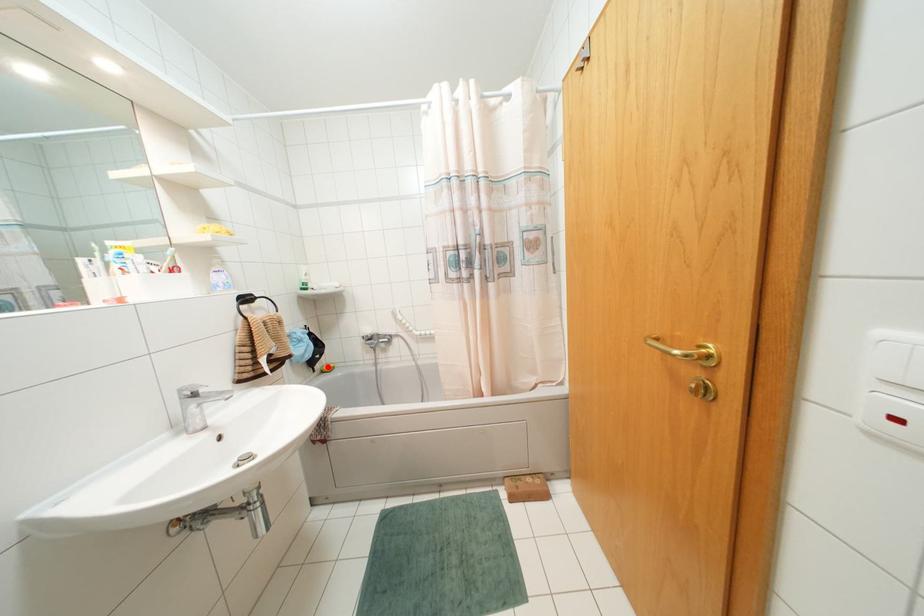
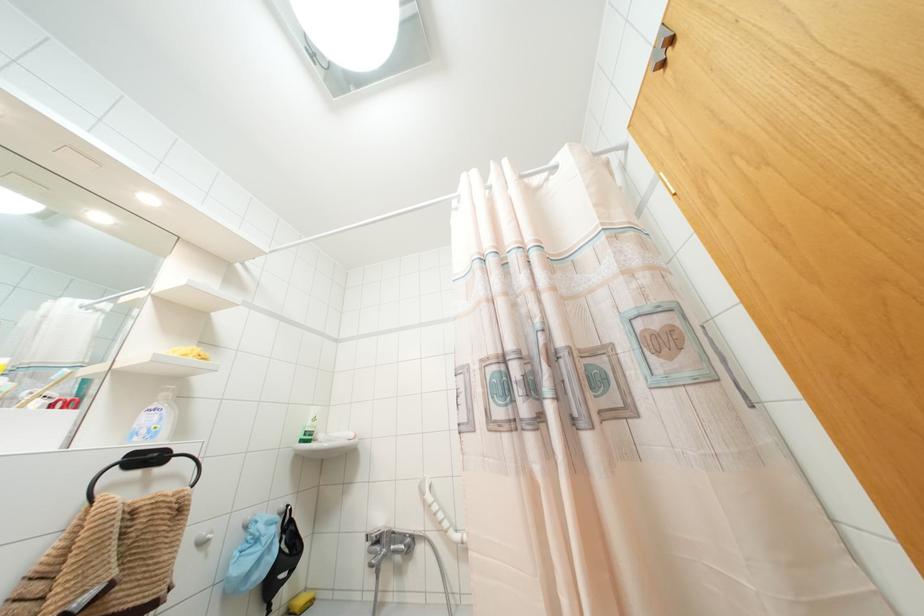
Locate, in the second image, the point that corresponds to the highlighted location in the first image.

(299, 601)